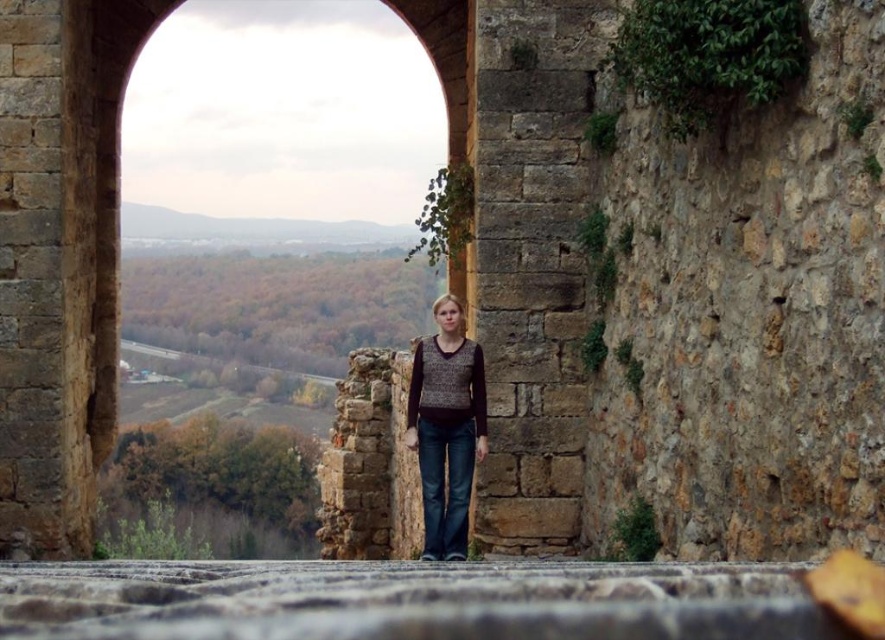
You are standing at the entrance of the stone archway in the image. There are two points marked on the ground in front of you. One is at coordinates point (117, 225) and the other at point (458, 550). Which point is closer to you?

Point (458, 550) is closer to you because point (117, 225) is behind it.

You are a photographer planning to take a portrait of the person wearing the knit sweater at center. Given the stone archway at center in the background, will the archway appear larger or smaller in the photo compared to the sweater?

The stone archway at center is much taller than the knit sweater at center, so in the photo, the archway will appear larger than the sweater.

You are a photographer planning to capture a wide shot of the stone archway at center and the knit sweater at center. Given the size difference between them, which object would you need to position closer to the camera to ensure both appear balanced in the frame?

The knit sweater at center is smaller than the stone archway at center, so positioning it closer to the camera would help balance their sizes in the photo.